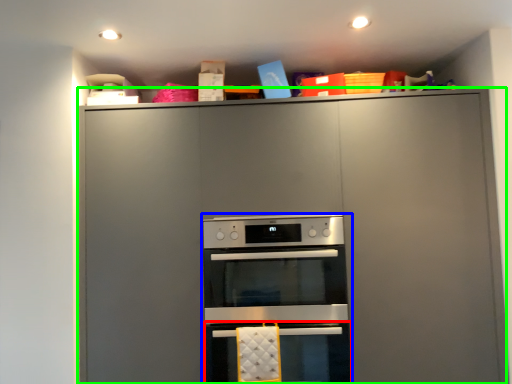
Question: Which object is positioned farthest from oven (highlighted by a red box)? Select from oven (highlighted by a blue box) and cabinetry (highlighted by a green box).

Choices:
 (A) oven
 (B) cabinetry

Answer: (B)